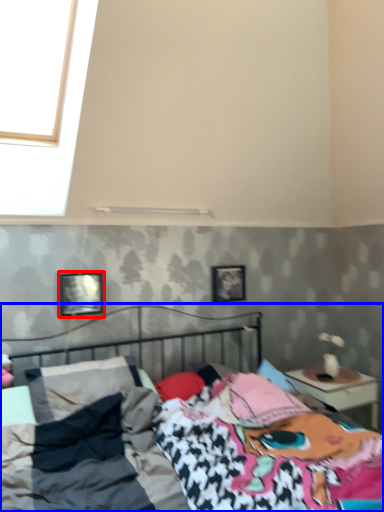
Question: Which object is further to the camera taking this photo, picture frame (highlighted by a red box) or bed (highlighted by a blue box)?

Choices:
 (A) picture frame
 (B) bed

Answer: (A)